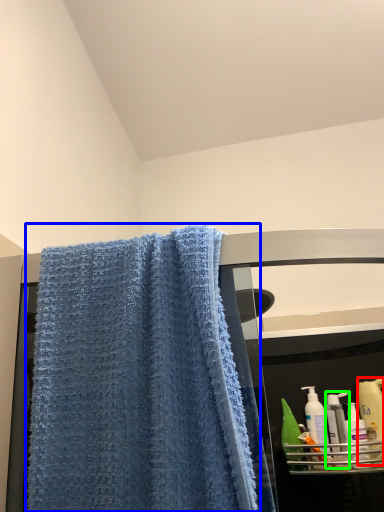
Question: Which object is positioned farthest from cleaning product (highlighted by a red box)? Select from towel (highlighted by a blue box) and mouthwash (highlighted by a green box).

Choices:
 (A) towel
 (B) mouthwash

Answer: (A)